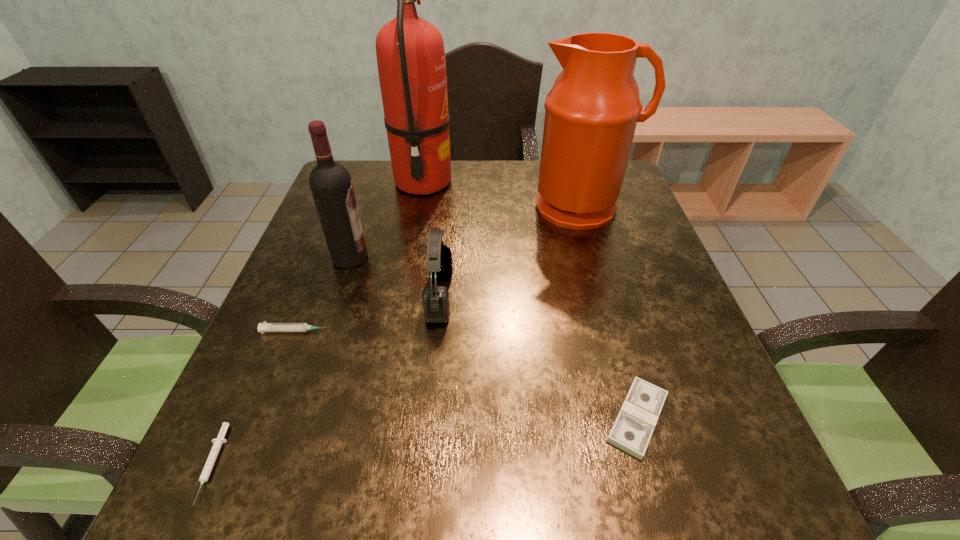
Locate an element on the screen. free location that satisfies the following two spatial constraints: 1. on the label of the fifth shortest object; 2. on the front side of the shorter syringe is located at coordinates (281, 464).

In order to click on free region that satisfies the following two spatial constraints: 1. on the headband of the dollar; 2. on the left side of the fourth tallest object in this screenshot , I will do `click(428, 418)`.

Locate an element on the screen. This screenshot has width=960, height=540. vacant space that satisfies the following two spatial constraints: 1. on the back side of the dollar; 2. on the left side of the nearer syringe is located at coordinates (232, 418).